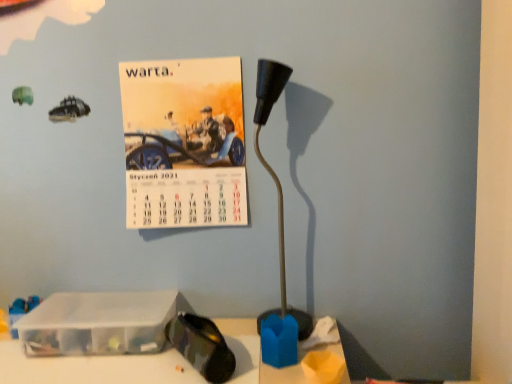
Question: Is transparent plastic container at lower left further to camera compared to black plastic lamp at center?

Choices:
 (A) no
 (B) yes

Answer: (B)

Question: From a real-world perspective, is transparent plastic container at lower left beneath black plastic lamp at center?

Choices:
 (A) no
 (B) yes

Answer: (B)

Question: Does transparent plastic container at lower left have a greater height compared to black plastic lamp at center?

Choices:
 (A) no
 (B) yes

Answer: (A)

Question: Is transparent plastic container at lower left next to black plastic lamp at center and touching it?

Choices:
 (A) no
 (B) yes

Answer: (A)

Question: Can you confirm if transparent plastic container at lower left is wider than black plastic lamp at center?

Choices:
 (A) no
 (B) yes

Answer: (B)

Question: From the image's perspective, is transparent plastic container at lower left above black plastic lamp at center?

Choices:
 (A) no
 (B) yes

Answer: (A)

Question: From a real-world perspective, is matte paper calendar at upper left under black plastic lamp at center?

Choices:
 (A) no
 (B) yes

Answer: (A)

Question: Is matte paper calendar at upper left wider than black plastic lamp at center?

Choices:
 (A) no
 (B) yes

Answer: (A)

Question: Is matte paper calendar at upper left outside black plastic lamp at center?

Choices:
 (A) yes
 (B) no

Answer: (A)

Question: Is matte paper calendar at upper left beside black plastic lamp at center?

Choices:
 (A) yes
 (B) no

Answer: (B)

Question: Does matte paper calendar at upper left have a lesser height compared to black plastic lamp at center?

Choices:
 (A) no
 (B) yes

Answer: (B)

Question: Does matte paper calendar at upper left have a smaller size compared to black plastic lamp at center?

Choices:
 (A) yes
 (B) no

Answer: (B)

Question: Considering the relative sizes of transparent plastic container at lower left and matte paper calendar at upper left in the image provided, is transparent plastic container at lower left shorter than matte paper calendar at upper left?

Choices:
 (A) yes
 (B) no

Answer: (A)